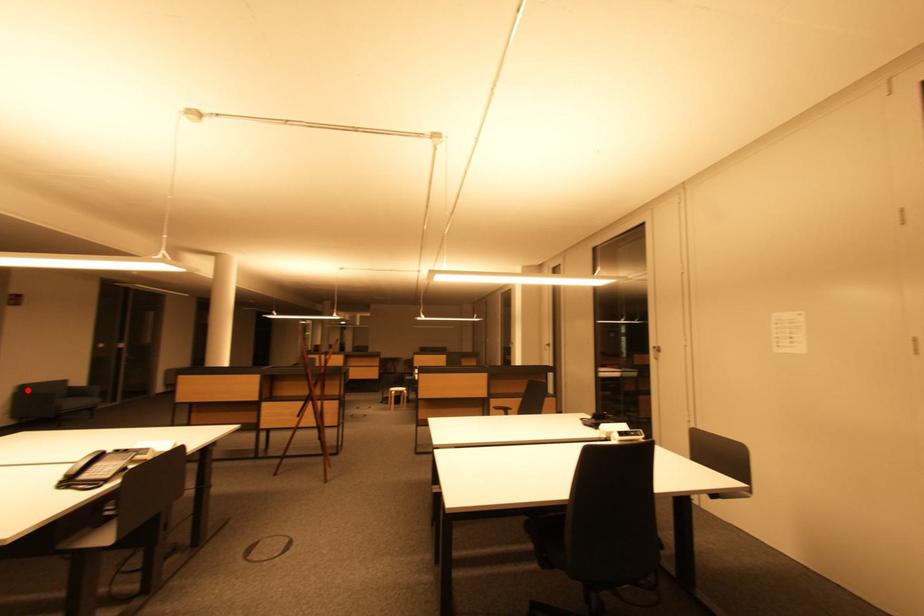
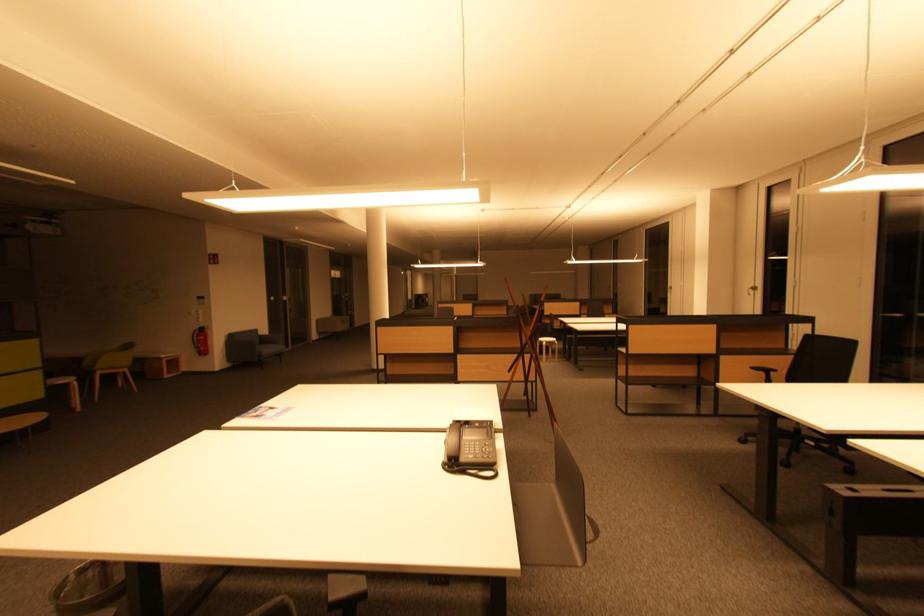
Question: A red point is marked in image1. In image2, is the corresponding 3D point closer to the camera or farther? Reply with the corresponding letter.

Choices:
 (A) The corresponding 3D point is closer.
 (B) The corresponding 3D point is farther.

Answer: (B)